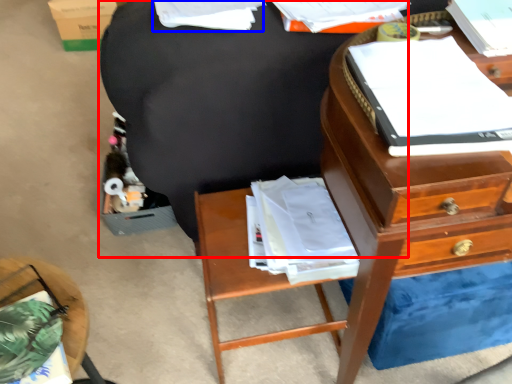
Question: Which point is further to the camera, bean bag chair (highlighted by a red box) or book (highlighted by a blue box)?

Choices:
 (A) bean bag chair
 (B) book

Answer: (A)